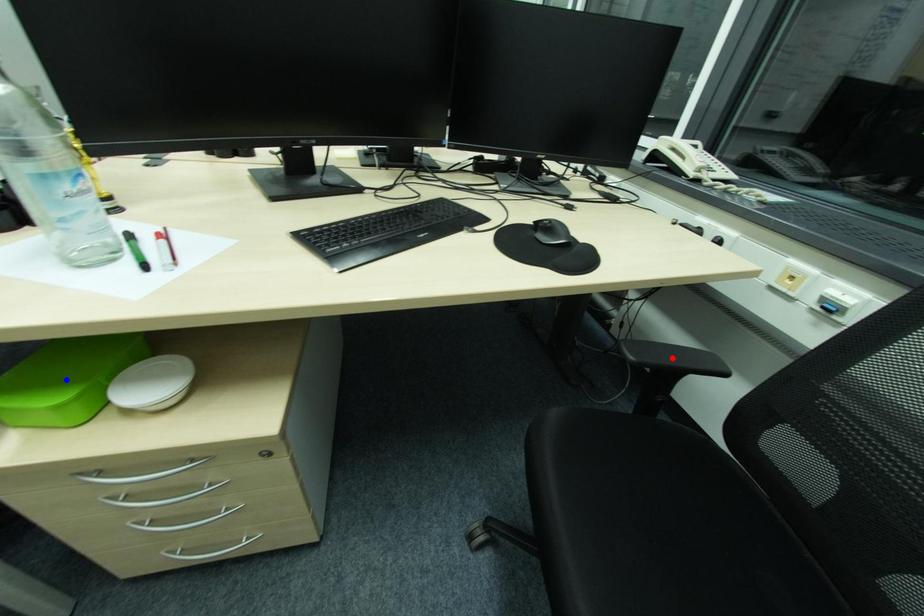
Question: Two points are marked on the image. Which point is closer to the camera?

Choices:
 (A) Blue point is closer.
 (B) Red point is closer.

Answer: (A)